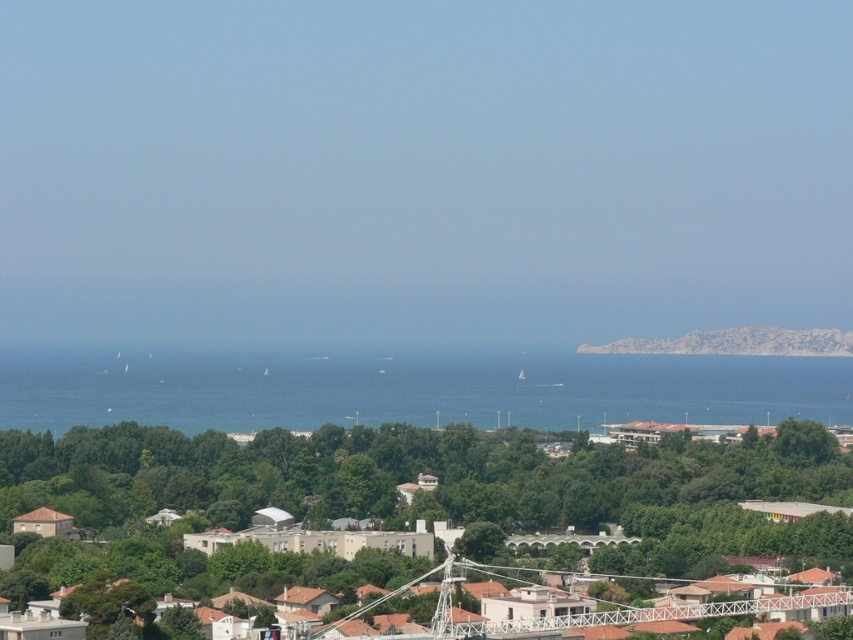
Does green leafy tree at center appear over blue water at center?

No, green leafy tree at center is not above blue water at center.

Between point (773, 554) and point (225, 364), which one is positioned in front?

Point (225, 364) is in front.

Is point (524, 433) positioned before point (432, 368)?

No, it is behind (432, 368).

Find the location of a particular element. This screenshot has height=640, width=853. green leafy tree at center is located at coordinates (456, 484).

Which is more to the left, green leafy tree at center or rocky cliff at right?

green leafy tree at center

Is green leafy tree at center thinner than rocky cliff at right?

In fact, green leafy tree at center might be wider than rocky cliff at right.

Which is behind, point (360, 504) or point (637, 339)?

The point (637, 339) is more distant.

This screenshot has width=853, height=640. I want to click on green leafy tree at center, so click(456, 484).

Can you confirm if blue water at center is wider than rocky cliff at right?

Yes, blue water at center is wider than rocky cliff at right.

Which is in front, point (341, 406) or point (672, 344)?

Point (341, 406) is more forward.

Is point (374, 365) positioned in front of point (749, 344)?

Yes, point (374, 365) is in front of point (749, 344).

Find the location of `blue water at center`. blue water at center is located at coordinates (419, 388).